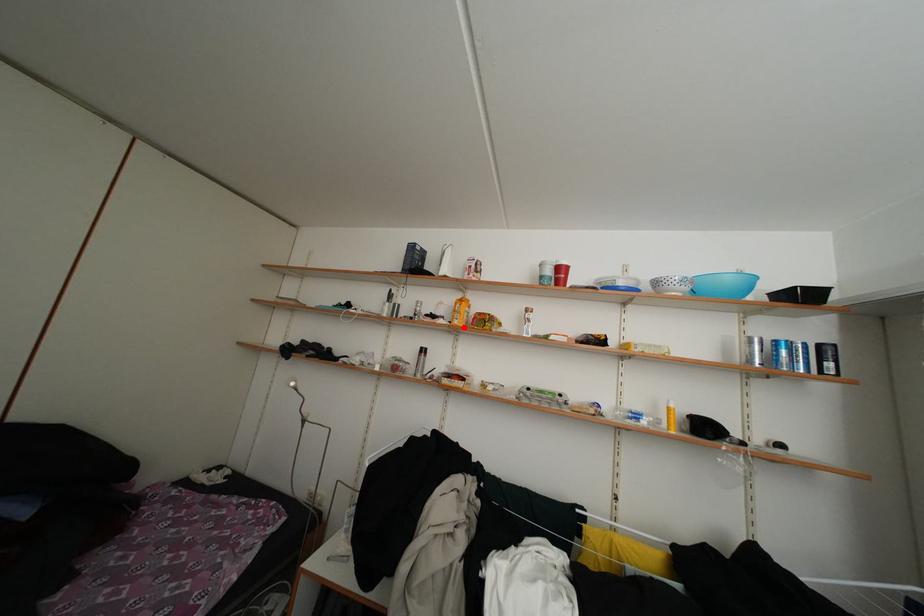
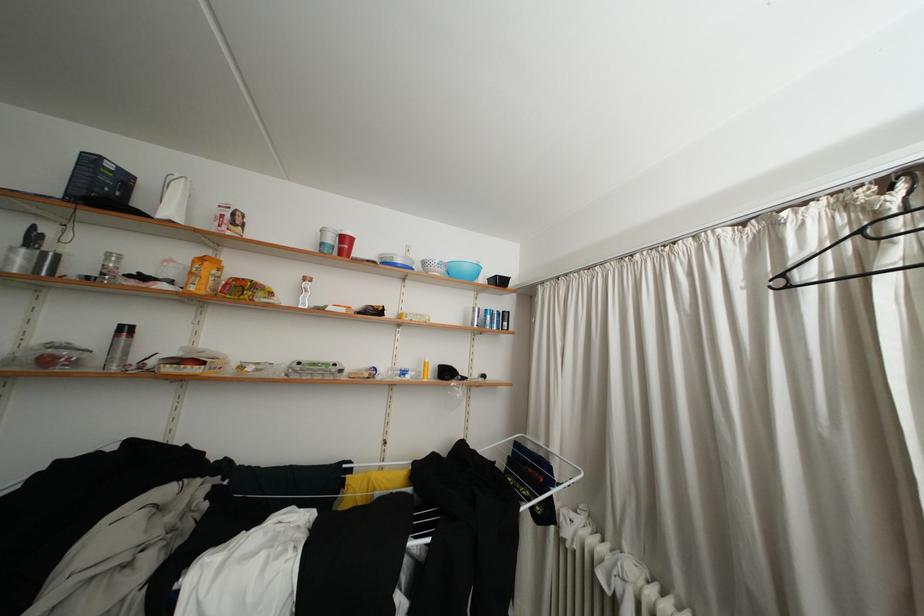
Find the pixel in the second image that matches the highlighted location in the first image.

(200, 294)